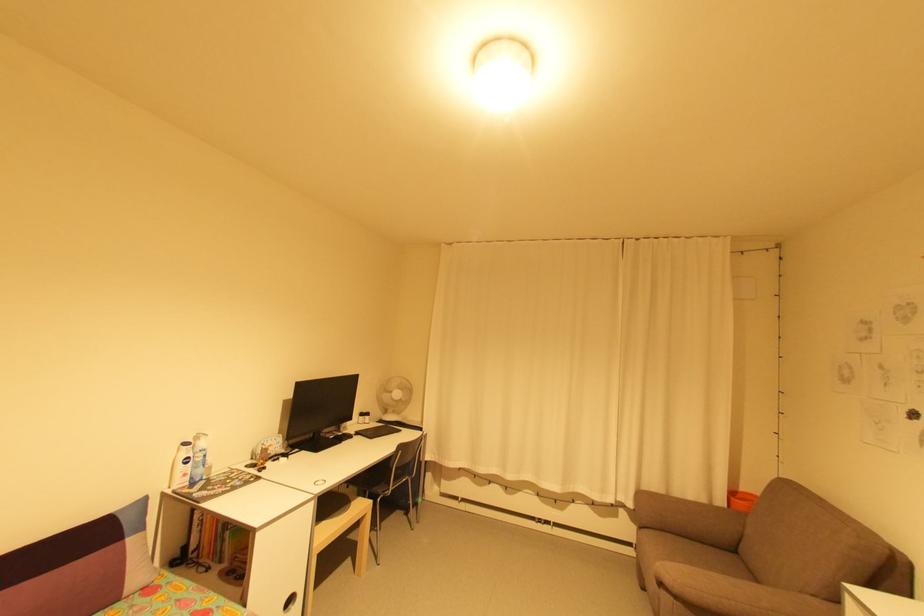
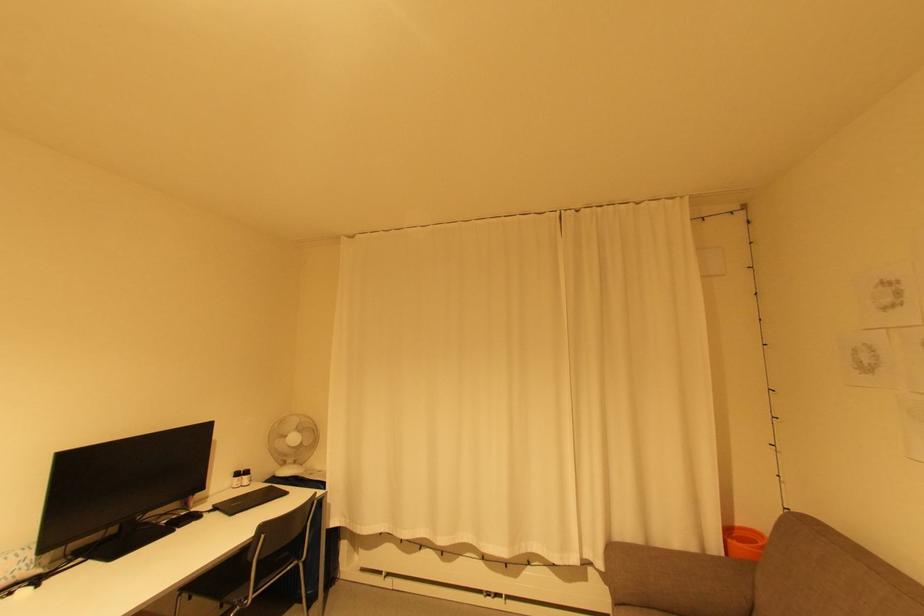
The point at (578, 501) is marked in the first image. Where is the corresponding point in the second image?

(533, 564)